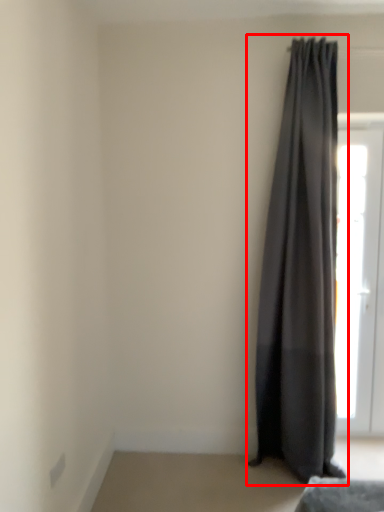
Question: From the image's perspective, what is the correct spatial positioning of curtain (annotated by the red box) in reference to door?

Choices:
 (A) below
 (B) above

Answer: (B)